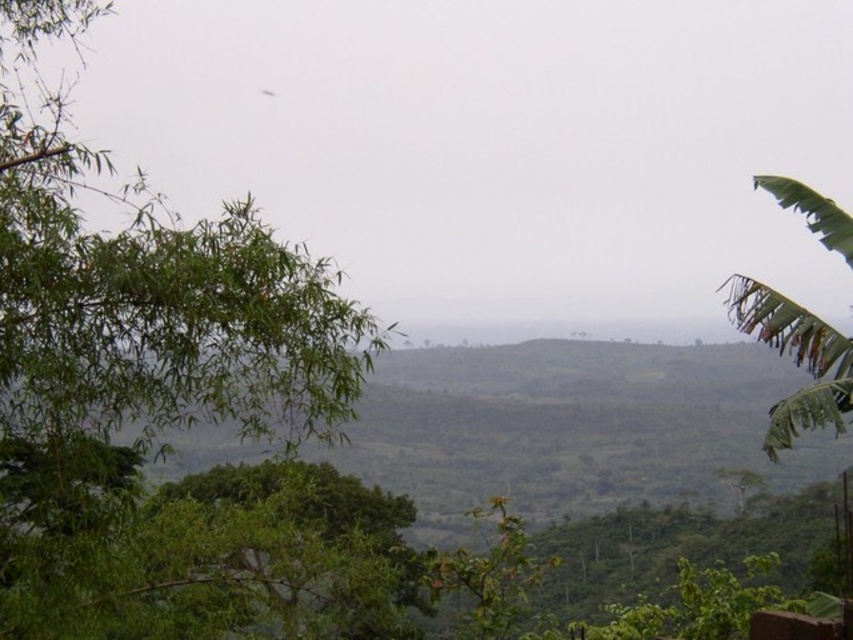
You are a hiker who wants to take a photo of both the green leafy tree at upper left and the green leafy tree at right from a position where both are visible in the frame. Given their heights, which tree should you position closer to the camera to ensure both are fully visible?

The green leafy tree at upper left is taller than the green leafy tree at right. To ensure both are fully visible in the photo, you should position yourself closer to the taller green leafy tree at upper left so that the shorter tree at right remains in frame without being obscured by the taller one.

You are an explorer navigating through this lush landscape. You need to determine the relative positions of the green leafy tree at upper left and the green leafy tree at right. Which tree is closer to you based on the spatial arrangement?

The green leafy tree at upper left is closer to you because it is positioned in front of the green leafy tree at right.

You are standing at the center of the image. Which direction should you move to get closer to the green leafy tree at upper left?

You should move towards the upper left direction to get closer to the green leafy tree at upper left since it is located at point (160, 397), which is in the upper left quadrant of the image.